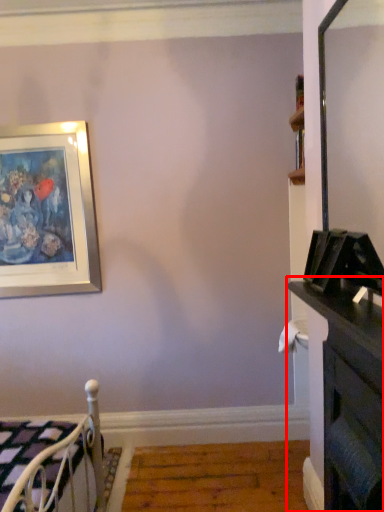
Question: From the image's perspective, what is the correct spatial relationship of dresser (annotated by the red box) in relation to furniture?

Choices:
 (A) above
 (B) below

Answer: (A)